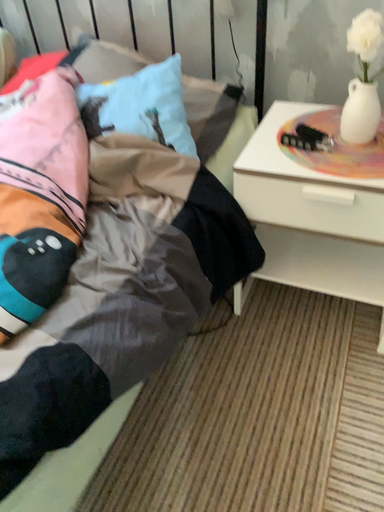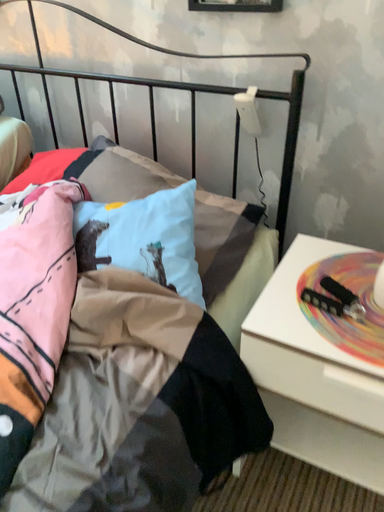
Question: Which way did the camera rotate in the video?

Choices:
 (A) rotated upward
 (B) rotated downward

Answer: (A)